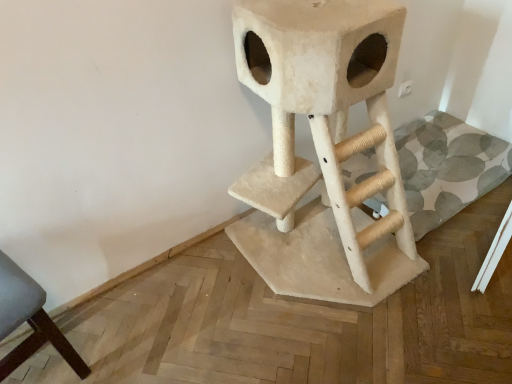
Question: Considering the relative positions of beige carpeted cat tree at center and dark gray fabric chair at lower left in the image provided, is beige carpeted cat tree at center to the right of dark gray fabric chair at lower left from the viewer's perspective?

Choices:
 (A) yes
 (B) no

Answer: (A)

Question: From the image's perspective, would you say beige carpeted cat tree at center is positioned over dark gray fabric chair at lower left?

Choices:
 (A) no
 (B) yes

Answer: (B)

Question: Can you confirm if beige carpeted cat tree at center is bigger than dark gray fabric chair at lower left?

Choices:
 (A) no
 (B) yes

Answer: (B)

Question: Is beige carpeted cat tree at center completely or partially outside of dark gray fabric chair at lower left?

Choices:
 (A) yes
 (B) no

Answer: (A)

Question: Can you confirm if beige carpeted cat tree at center is positioned to the left of dark gray fabric chair at lower left?

Choices:
 (A) yes
 (B) no

Answer: (B)

Question: Is dark gray fabric chair at lower left surrounded by beige carpeted cat tree at center?

Choices:
 (A) yes
 (B) no

Answer: (B)

Question: Is dark gray fabric chair at lower left shorter than beige carpeted cat tree at center?

Choices:
 (A) yes
 (B) no

Answer: (A)

Question: Is dark gray fabric chair at lower left wider than beige carpeted cat tree at center?

Choices:
 (A) no
 (B) yes

Answer: (A)

Question: Does dark gray fabric chair at lower left appear on the right side of beige carpeted cat tree at center?

Choices:
 (A) yes
 (B) no

Answer: (B)

Question: Would you say beige carpeted cat tree at center is part of dark gray fabric chair at lower left's contents?

Choices:
 (A) no
 (B) yes

Answer: (A)

Question: Is the surface of dark gray fabric chair at lower left in direct contact with beige carpeted cat tree at center?

Choices:
 (A) no
 (B) yes

Answer: (A)

Question: Is dark gray fabric chair at lower left taller than beige carpeted cat tree at center?

Choices:
 (A) yes
 (B) no

Answer: (B)

Question: In terms of size, does dark gray fabric chair at lower left appear bigger or smaller than beige carpeted cat tree at center?

Choices:
 (A) big
 (B) small

Answer: (B)